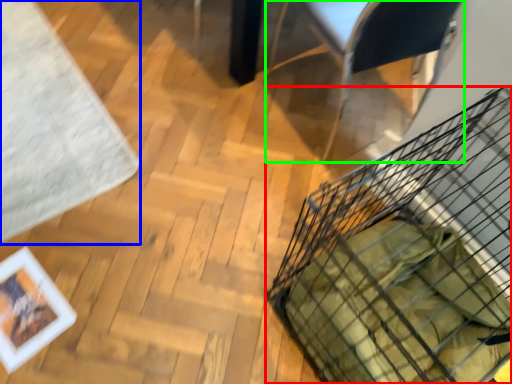
Question: Which is nearer to the basket (highlighted by a red box)? mat (highlighted by a blue box) or armchair (highlighted by a green box).

Choices:
 (A) mat
 (B) armchair

Answer: (B)